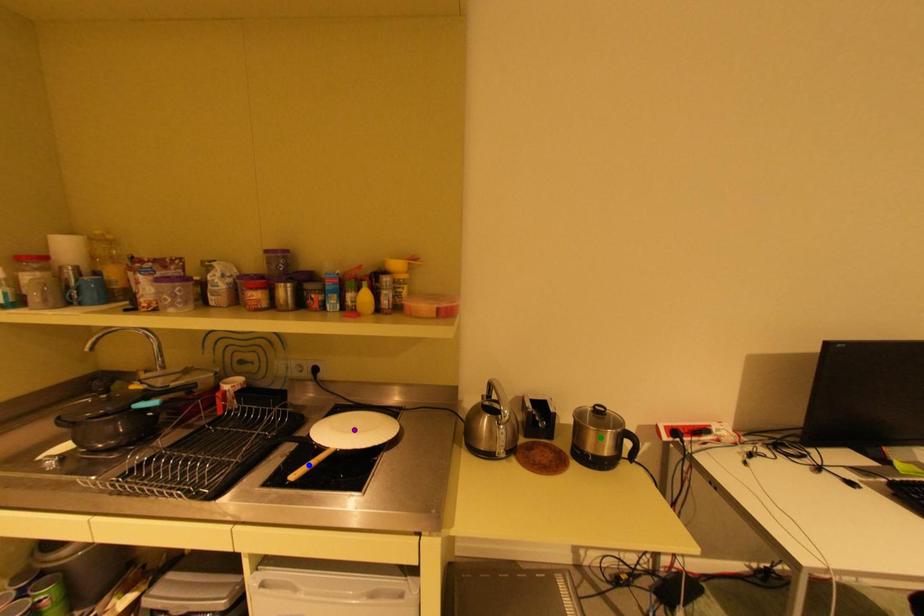
Order these from nearest to farthest:
A) green point
B) purple point
C) blue point

purple point → green point → blue point